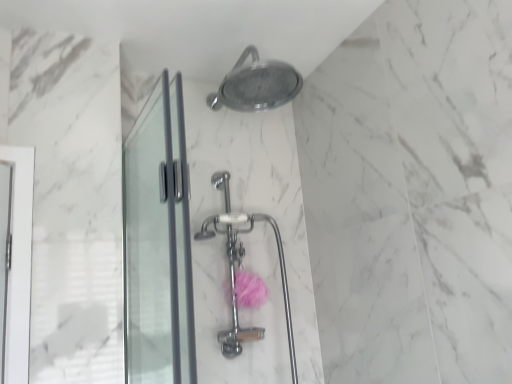
Where is `transparent glass screen door at left`? transparent glass screen door at left is located at coordinates (158, 243).

This screenshot has height=384, width=512. What do you see at coordinates (158, 243) in the screenshot? I see `transparent glass screen door at left` at bounding box center [158, 243].

Locate an element on the screen. transparent glass screen door at left is located at coordinates (158, 243).